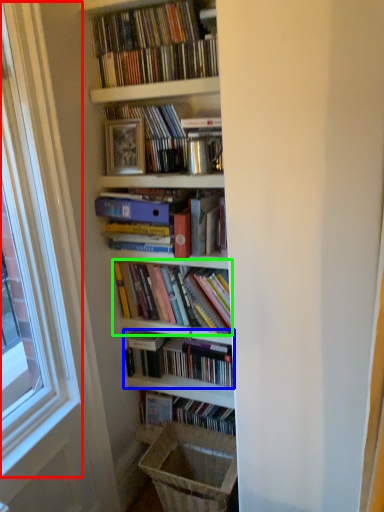
Question: Which is farther away from window frame (highlighted by a red box)? book (highlighted by a blue box) or book (highlighted by a green box)?

Choices:
 (A) book
 (B) book

Answer: (A)